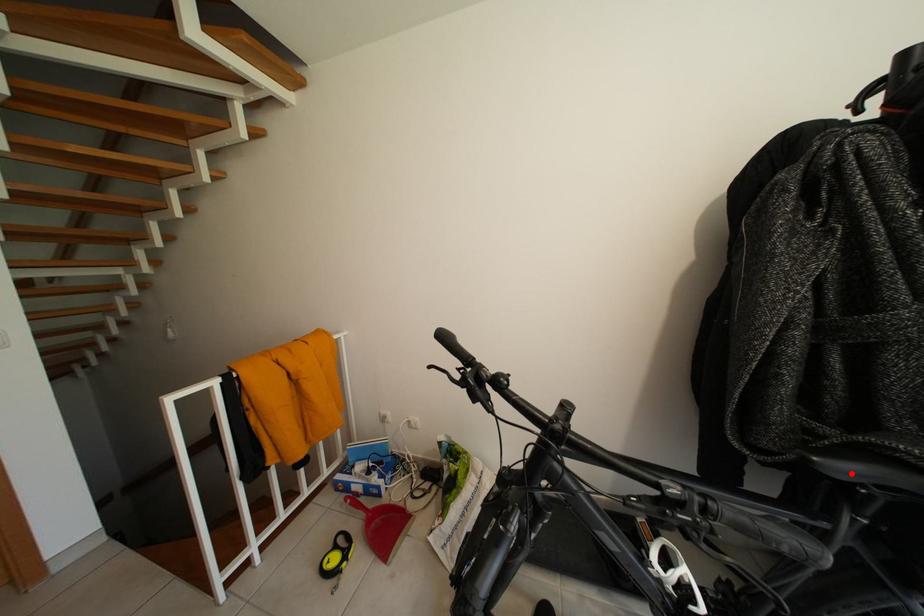
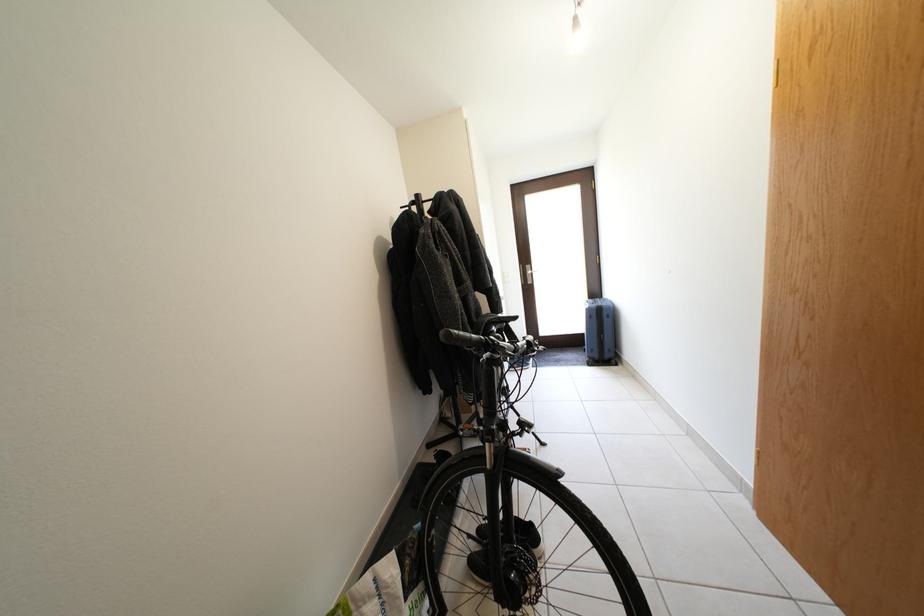
Question: I am providing you with two images of the same scene from different viewpoints. A red point is marked on the first image. Is the red point's position out of view in image 2?

Choices:
 (A) Yes
 (B) No

Answer: (A)